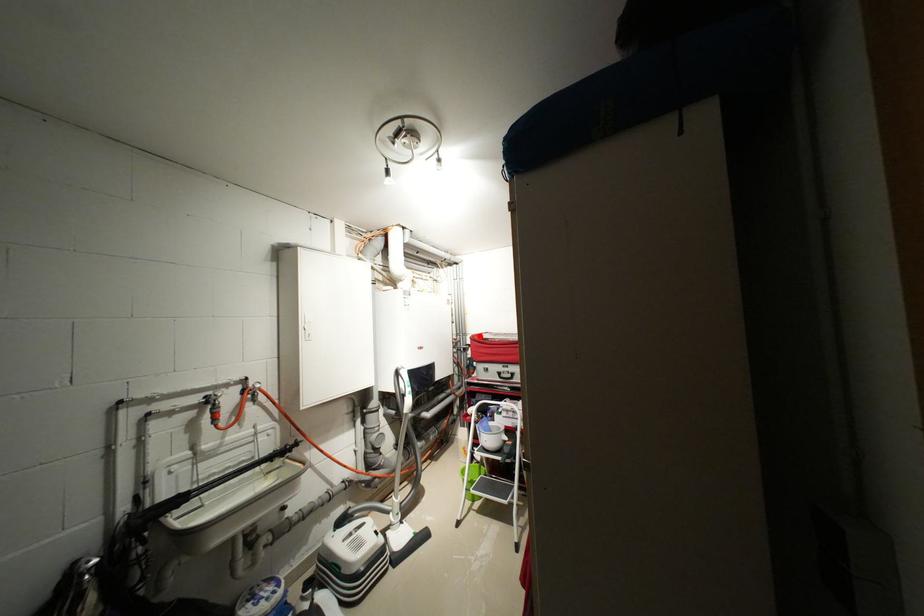
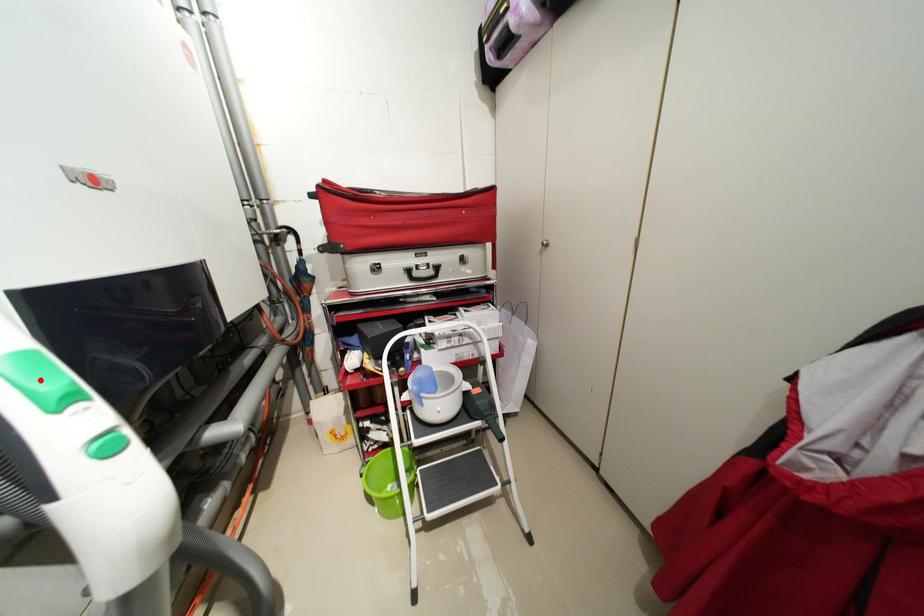
I am providing you with two images of the same scene from different viewpoints. A red point is marked on the first image and another point is marked on the second image. Do the highlighted points in image1 and image2 indicate the same real-world spot?

No